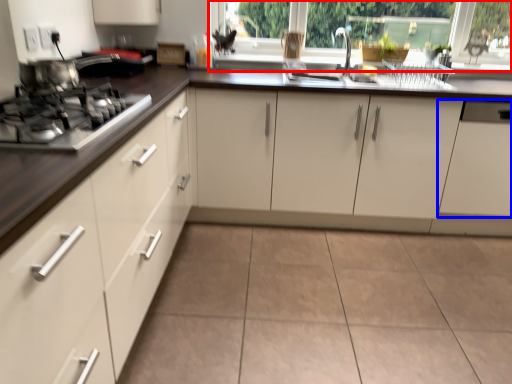
Question: Which point is closer to the camera, window frame (highlighted by a red box) or cabinetry (highlighted by a blue box)?

Choices:
 (A) window frame
 (B) cabinetry

Answer: (B)